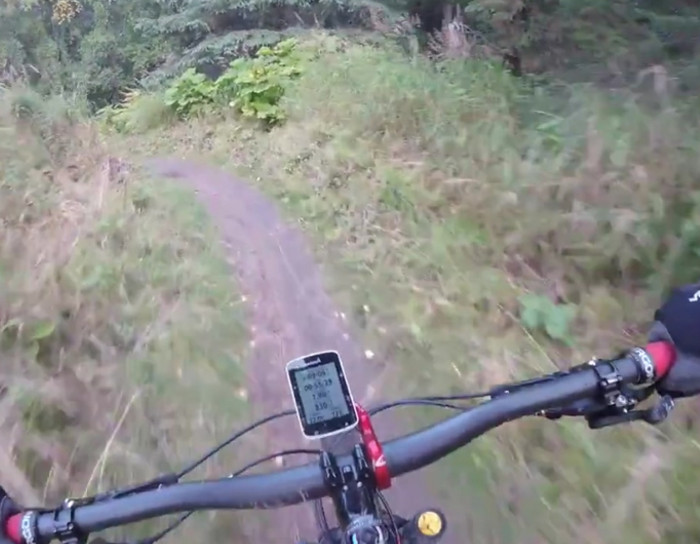
Locate an element on the screen. handles is located at coordinates pyautogui.click(x=15, y=511), pyautogui.click(x=668, y=360).